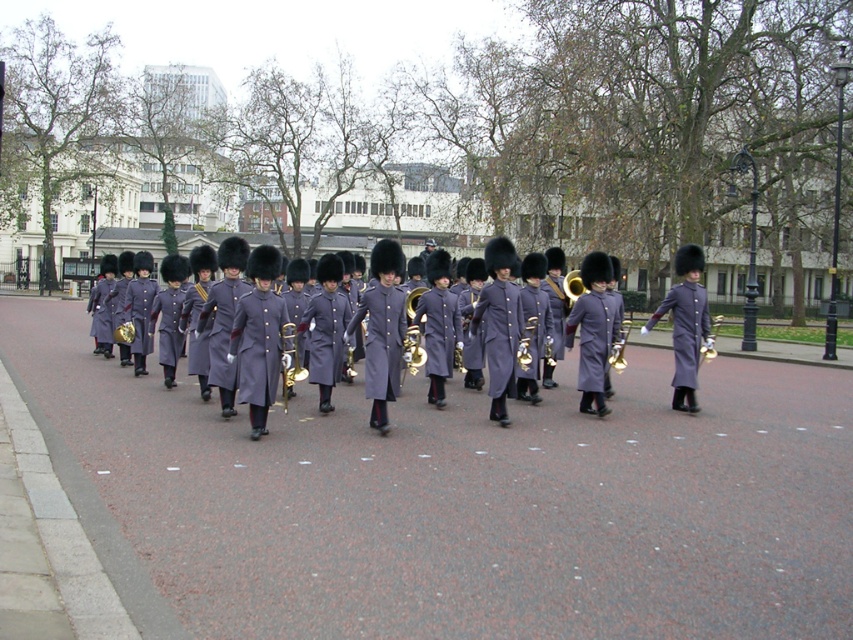
Which is above, matte purple uniform at center or gold brass instrument at center?

matte purple uniform at center

Can you confirm if matte purple uniform at center is positioned below gold brass instrument at center?

Incorrect, matte purple uniform at center is not positioned below gold brass instrument at center.

Which is behind, point (434, 269) or point (120, 332)?

Point (120, 332)

Locate an element on the screen. matte purple uniform at center is located at coordinates (479, 323).

Is shiny brass trumpet at center further to the viewer compared to gold brass bell at center?

No, it is not.

Consider the image. Measure the distance between point (532,332) and camera.

Point (532,332) and camera are 11.42 meters apart.

Find the location of a particular element. shiny brass trumpet at center is located at coordinates (526, 342).

Is gold brass bell at center above gold brass instrument at center?

Actually, gold brass bell at center is below gold brass instrument at center.

Locate an element on the screen. The image size is (853, 640). gold brass bell at center is located at coordinates (709, 340).

The width and height of the screenshot is (853, 640). In order to click on gold brass bell at center in this screenshot , I will do `click(709, 340)`.